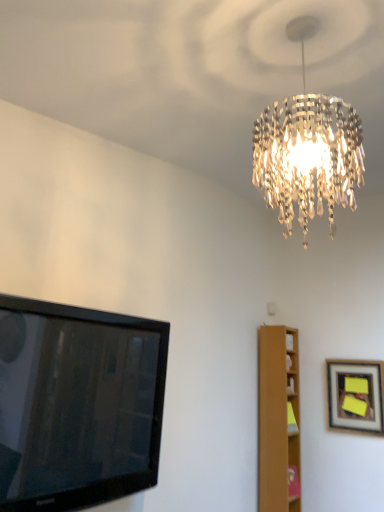
Question: Does point (360, 415) appear closer or farther from the camera than point (122, 358)?

Choices:
 (A) closer
 (B) farther

Answer: (A)

Question: Would you say wooden framed picture at right is to the left or to the right of black glossy tv at left in the picture?

Choices:
 (A) left
 (B) right

Answer: (B)

Question: Which object is positioned farthest from the wooden framed picture at right?

Choices:
 (A) light brown wooden bookshelf at right
 (B) black glossy tv at left

Answer: (B)

Question: Which is farther from the light brown wooden bookshelf at right?

Choices:
 (A) black glossy tv at left
 (B) wooden framed picture at right

Answer: (A)